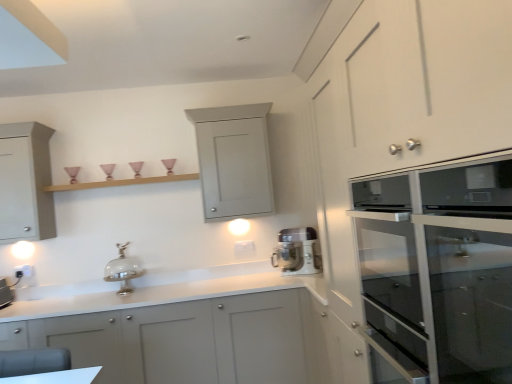
Question: Does matte glass oven at right, positioned as the fourth cabinetry in back-to-front order, turn towards matte gray cabinet at lower left, which is counted as the 2th cabinetry, starting from the front?

Choices:
 (A) no
 (B) yes

Answer: (A)

Question: From a real-world perspective, is matte glass oven at right, positioned as the fourth cabinetry in back-to-front order, positioned over matte gray cabinet at lower left, the third cabinetry when ordered from back to front, based on gravity?

Choices:
 (A) yes
 (B) no

Answer: (A)

Question: From the image's perspective, is matte glass oven at right, positioned as the fourth cabinetry in back-to-front order, located above matte gray cabinet at lower left, the third cabinetry when ordered from back to front?

Choices:
 (A) no
 (B) yes

Answer: (B)

Question: Is the position of matte glass oven at right, the first cabinetry from the front, more distant than that of matte gray cabinet at lower left, the third cabinetry when ordered from back to front?

Choices:
 (A) no
 (B) yes

Answer: (A)

Question: Are matte glass oven at right, the first cabinetry from the front, and matte gray cabinet at lower left, which is counted as the 2th cabinetry, starting from the front, far apart?

Choices:
 (A) no
 (B) yes

Answer: (B)

Question: Is matte glass oven at right, positioned as the fourth cabinetry in back-to-front order, bigger than matte gray cabinet at lower left, the third cabinetry when ordered from back to front?

Choices:
 (A) yes
 (B) no

Answer: (B)

Question: Are matte gray cabinet at left, which ranks as the third cabinetry in front-to-back order, and matte gray cabinet at upper center, the 1th cabinetry positioned from the back, making contact?

Choices:
 (A) yes
 (B) no

Answer: (B)

Question: Are matte gray cabinet at left, which ranks as the 2th cabinetry in back-to-front order, and matte gray cabinet at upper center, the fourth cabinetry from the front, located far from each other?

Choices:
 (A) no
 (B) yes

Answer: (B)

Question: Considering the relative sizes of matte gray cabinet at left, which ranks as the third cabinetry in front-to-back order, and matte gray cabinet at upper center, the fourth cabinetry from the front, in the image provided, is matte gray cabinet at left, which ranks as the third cabinetry in front-to-back order, bigger than matte gray cabinet at upper center, the fourth cabinetry from the front,?

Choices:
 (A) yes
 (B) no

Answer: (B)

Question: Is matte gray cabinet at left, which ranks as the third cabinetry in front-to-back order, in front of matte gray cabinet at upper center, the fourth cabinetry from the front?

Choices:
 (A) no
 (B) yes

Answer: (B)

Question: Is matte gray cabinet at left, which ranks as the third cabinetry in front-to-back order, facing towards matte gray cabinet at upper center, the fourth cabinetry from the front?

Choices:
 (A) yes
 (B) no

Answer: (B)

Question: Is matte gray cabinet at left, which ranks as the third cabinetry in front-to-back order, shorter than matte gray cabinet at upper center, the 1th cabinetry positioned from the back?

Choices:
 (A) no
 (B) yes

Answer: (A)

Question: Does matte glass oven at right, positioned as the fourth cabinetry in back-to-front order, turn towards white plastic electric outlet at lower left?

Choices:
 (A) yes
 (B) no

Answer: (B)